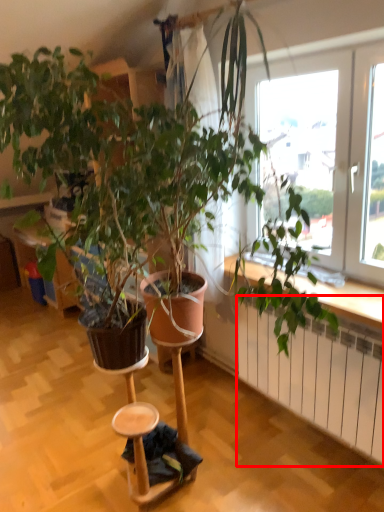
Question: Observing the image, what is the correct spatial positioning of radiator (annotated by the red box) in reference to step stool?

Choices:
 (A) left
 (B) right

Answer: (B)